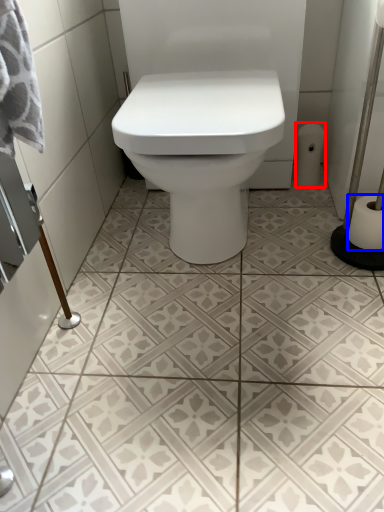
Question: Which point is closer to the camera, toilet paper (highlighted by a red box) or toilet paper (highlighted by a blue box)?

Choices:
 (A) toilet paper
 (B) toilet paper

Answer: (B)